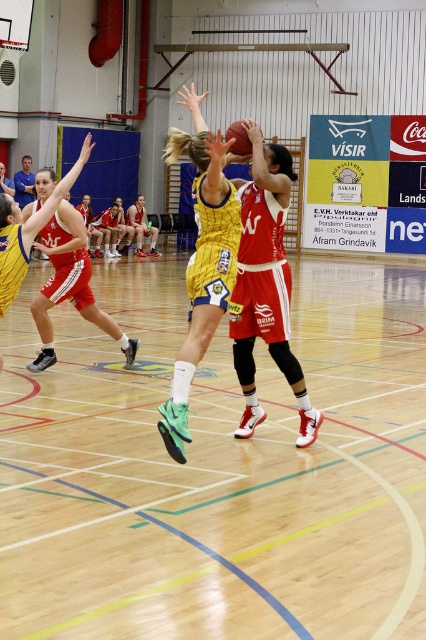
Consider the image. Is yellow jersey at center shorter than rubber textured basketball at center?

In fact, yellow jersey at center may be taller than rubber textured basketball at center.

Who is more distant from viewer, (129, 205) or (236, 122)?

Point (129, 205)

This screenshot has width=426, height=640. In order to click on yellow jersey at center in this screenshot , I will do `click(141, 227)`.

Can you confirm if shiny red basketball at center is positioned to the left of yellow jersey at center?

In fact, shiny red basketball at center is to the right of yellow jersey at center.

Between shiny red basketball at center and yellow jersey at center, which one appears on the right side from the viewer's perspective?

From the viewer's perspective, shiny red basketball at center appears more on the right side.

Where is `shiny red basketball at center`? This screenshot has width=426, height=640. shiny red basketball at center is located at coordinates (265, 284).

Does point (80, 374) come behind point (255, 426)?

Yes, it is behind point (255, 426).

Does wooden at center have a smaller size compared to shiny red basketball at center?

No.

Does point (333, 476) lie in front of point (262, 260)?

Yes, point (333, 476) is closer to viewer.

This screenshot has height=640, width=426. Identify the location of wooden at center. (216, 468).